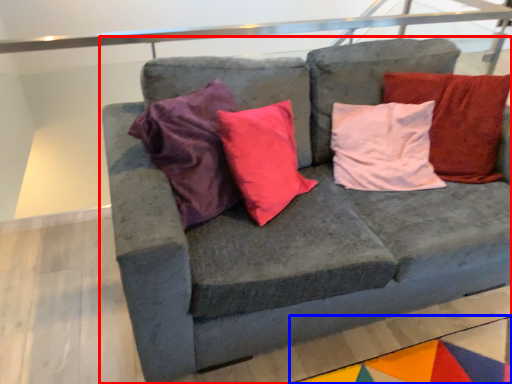
Question: Among these objects, which one is nearest to the camera, studio couch (highlighted by a red box) or mat (highlighted by a blue box)?

Choices:
 (A) studio couch
 (B) mat

Answer: (A)